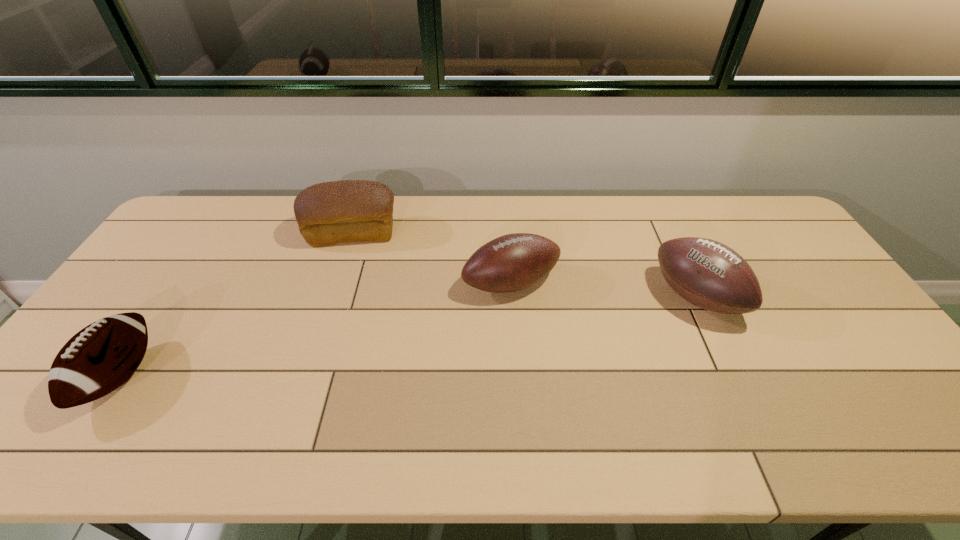
At what (x,y) coordinates should I click in order to perform the action: click on vacant space that's between the rightmost football (American) and the second football (American) from left to right. Please return your answer as a coordinate pair (x, y). Looking at the image, I should click on (603, 291).

The height and width of the screenshot is (540, 960). In order to click on empty space that is in between the rightmost football (American) and the third object from left to right in this screenshot , I will do `click(603, 291)`.

The height and width of the screenshot is (540, 960). Identify the location of unoccupied position between the farthest object and the second football (American) from left to right. (432, 258).

I want to click on free space between the second football (American) from right to left and the farthest object, so tap(432, 258).

Where is `free spot between the farthest object and the second object from right to left`? The image size is (960, 540). free spot between the farthest object and the second object from right to left is located at coordinates (432, 258).

At what (x,y) coordinates should I click in order to perform the action: click on vacant area that lies between the second football (American) from right to left and the bread. Please return your answer as a coordinate pair (x, y). The image size is (960, 540). Looking at the image, I should click on (432, 258).

Where is `free point between the third object from left to right and the farthest object`? free point between the third object from left to right and the farthest object is located at coordinates (432, 258).

Image resolution: width=960 pixels, height=540 pixels. In order to click on free space between the rightmost football (American) and the second object from right to left in this screenshot , I will do `click(603, 291)`.

Select which object is the third closest to the farthest object. Please provide its 2D coordinates. Your answer should be formatted as a tuple, i.e. [(x, y)], where the tuple contains the x and y coordinates of a point satisfying the conditions above.

[(708, 274)]

This screenshot has width=960, height=540. What are the coordinates of `object identified as the second closest to the second object from right to left` in the screenshot? It's located at (708, 274).